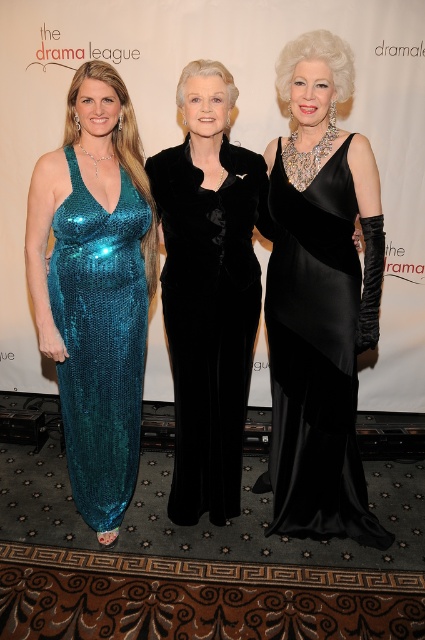
You are a photographer at the event and need to adjust the camera focus. Which woman is taller between the satin black dress at center and the teal sequined dress at center?

The satin black dress at center is much taller than the teal sequined dress at center, so the photographer should focus on the taller one first.

You are a photographer at the event and need to position a spotlight on the velvet black dress at center. According to the coordinates provided, where should you aim the spotlight?

The velvet black dress at center is located at point [209,291], so you should aim the spotlight at those coordinates to illuminate it properly.